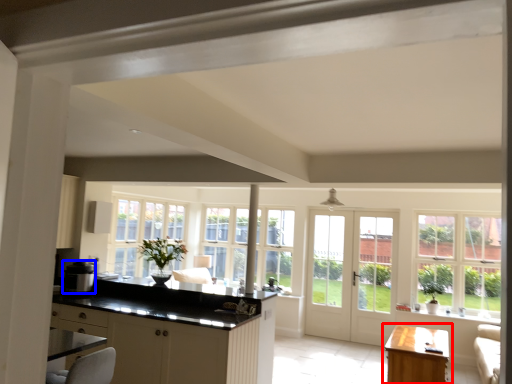
Question: Which of the following is the closest to the observer, table (highlighted by a red box) or appliance (highlighted by a blue box)?

Choices:
 (A) table
 (B) appliance

Answer: (A)